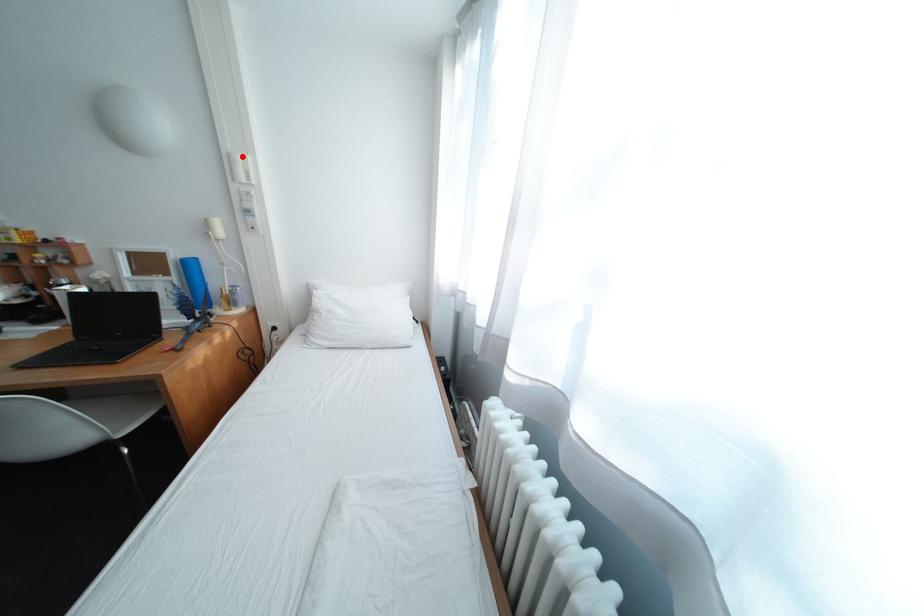
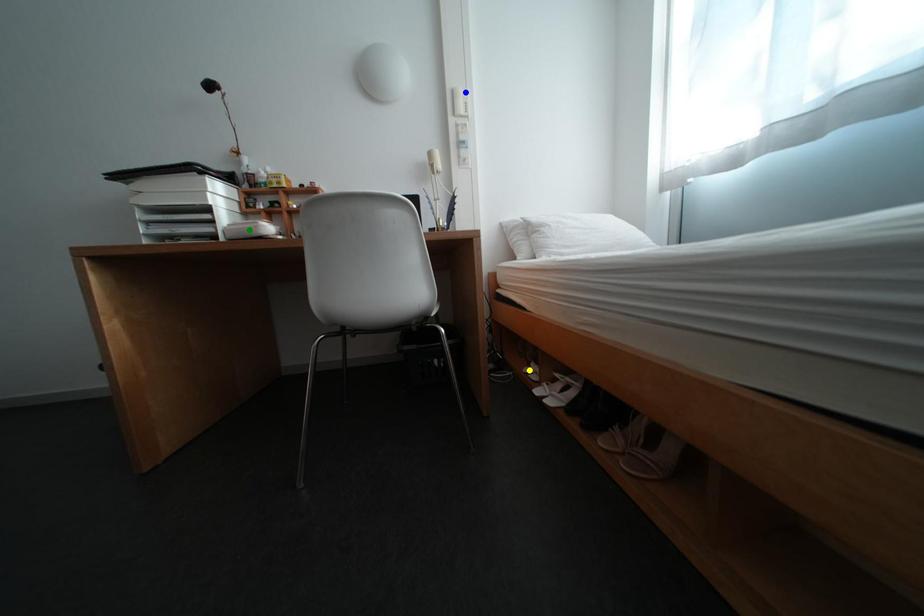
Question: I am providing you with two images of the same scene from different viewpoints. A red point is marked on the first image. You are given multiple points on the second image. Which point in image 2 represents the same 3d spot as the red point in image 1?

Choices:
 (A) yellow point
 (B) blue point
 (C) green point

Answer: (B)